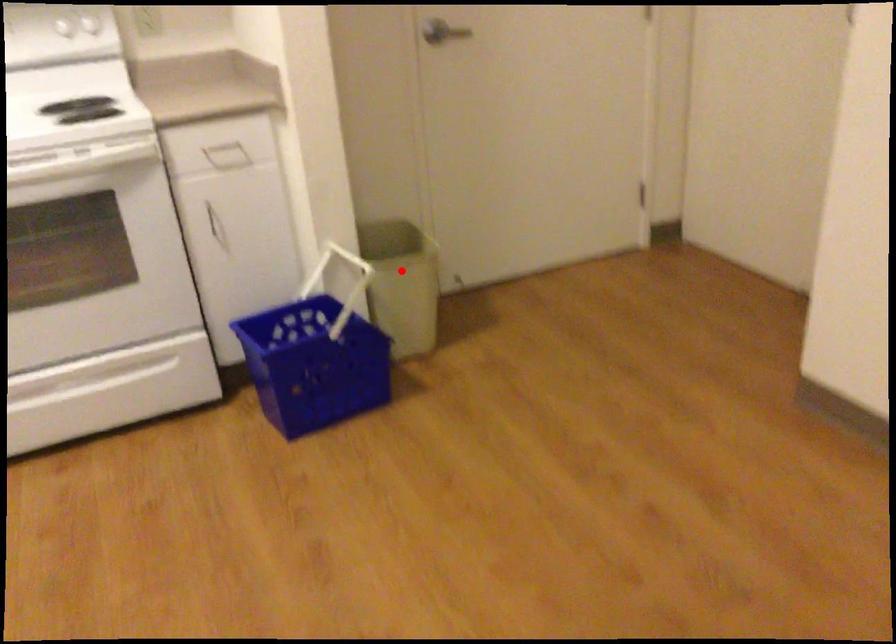
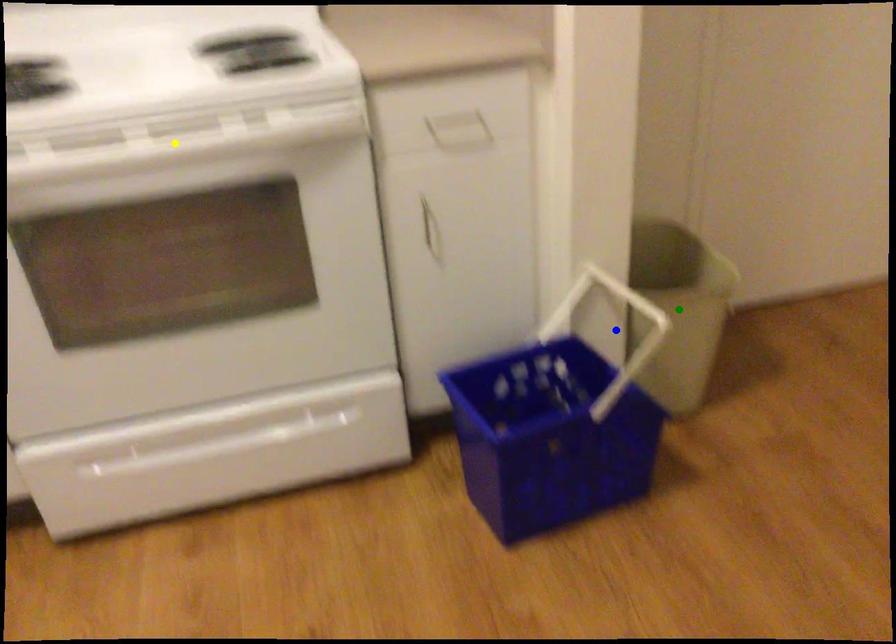
Question: I am providing you with two images of the same scene from different viewpoints. A red point is marked on the first image. You are given multiple points on the second image. In image 2, which mark is for the same physical point as the one in image 1?

Choices:
 (A) blue point
 (B) green point
 (C) yellow point

Answer: (B)